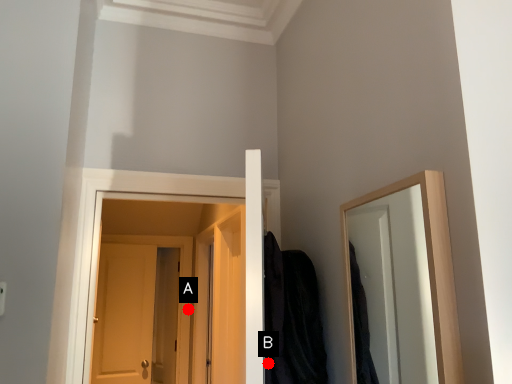
Question: Two points are circled on the image, labeled by A and B beside each circle. Among these points, which one is nearest to the camera?

Choices:
 (A) A is closer
 (B) B is closer

Answer: (B)